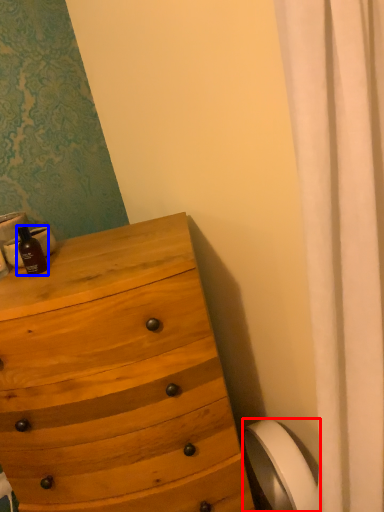
Question: Which object is further to the camera taking this photo, toilet paper (highlighted by a red box) or bottle (highlighted by a blue box)?

Choices:
 (A) toilet paper
 (B) bottle

Answer: (A)